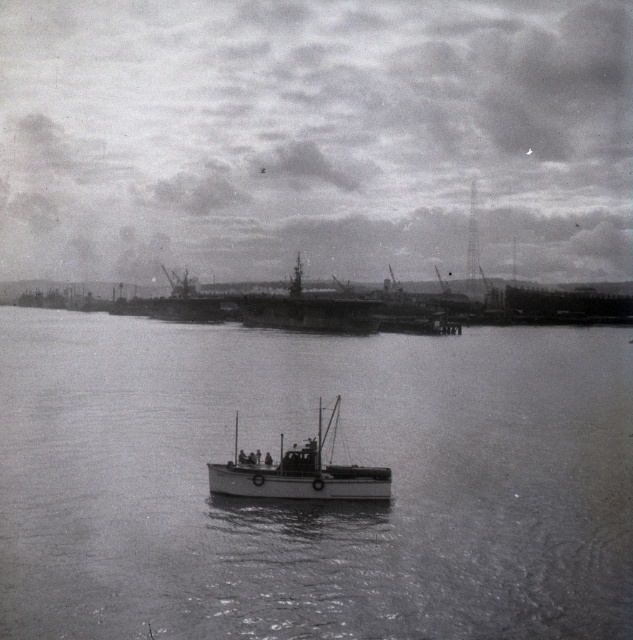
You are standing on the deck of the small boat in the foreground and want to look towards the larger ship docked at the pier. From your position, which of the two points, point (x=486, y=497) or point (x=360, y=320), is closer to you?

Point (x=486, y=497) is closer to you because it is in front of point (x=360, y=320).